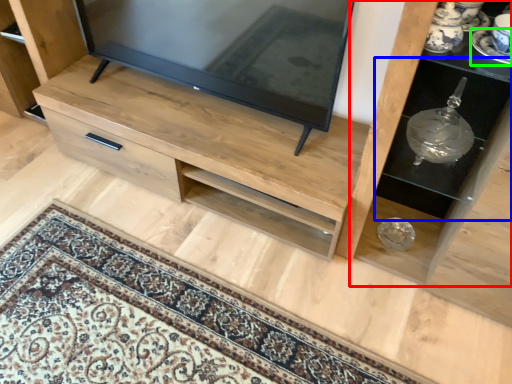
Question: Based on their relative distances, which object is nearer to shelf (highlighted by a red box)? Choose from shelf (highlighted by a blue box) and saucer (highlighted by a green box).

Choices:
 (A) shelf
 (B) saucer

Answer: (A)